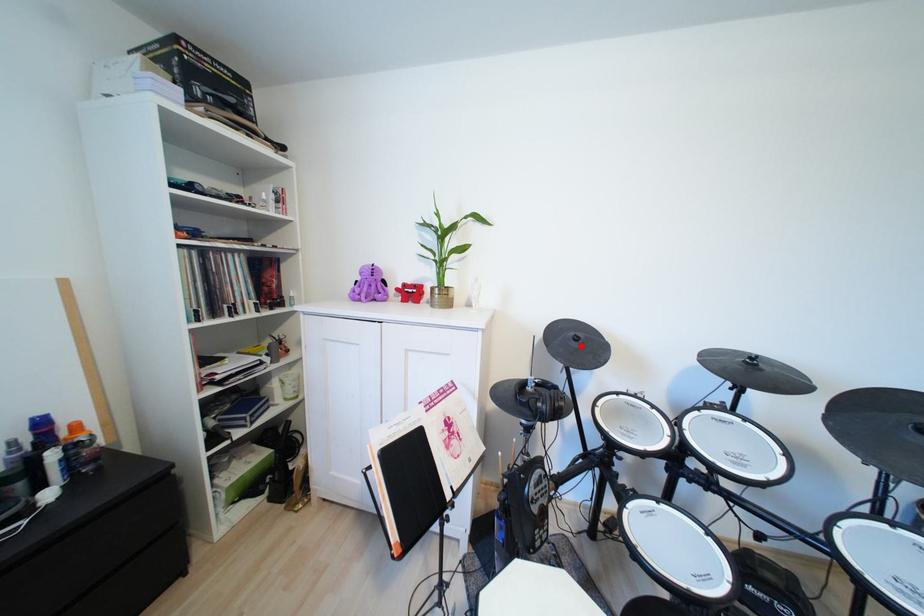
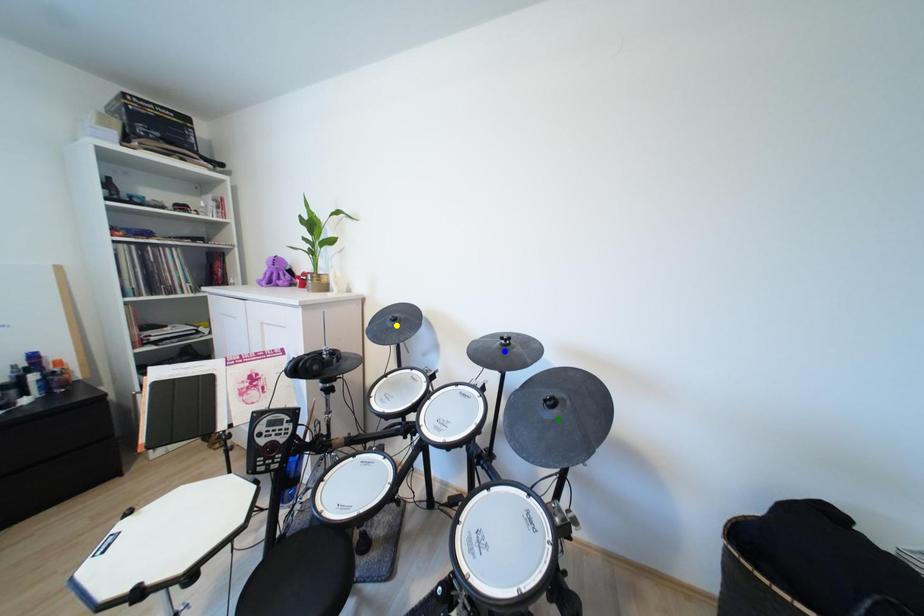
Question: I am providing you with two images of the same scene from different viewpoints. A red point is marked on the first image. You are given multiple points on the second image. Which spot in image 2 lines up with the point in image 1?

Choices:
 (A) green point
 (B) yellow point
 (C) blue point

Answer: (B)